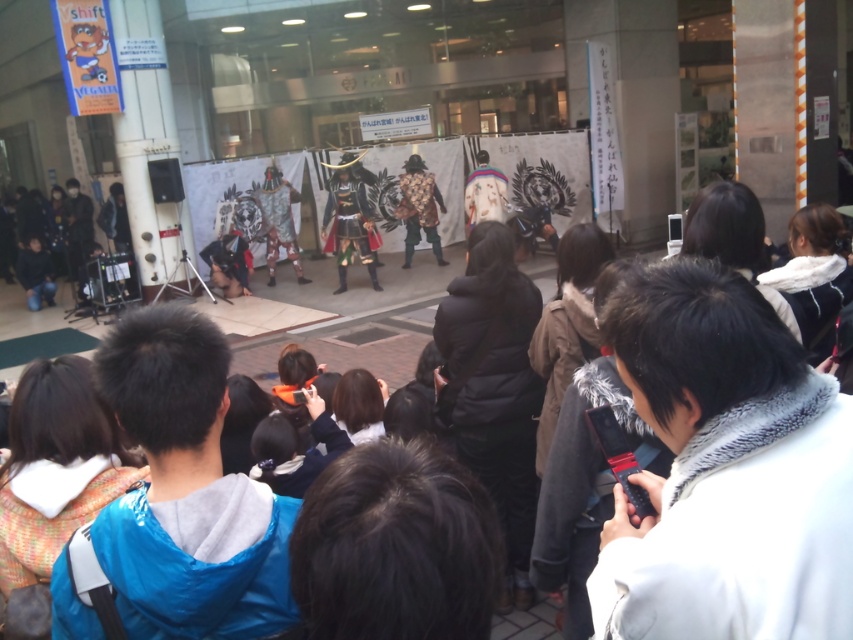
Question: Which of these objects is positioned closest to the white fur-trimmed coat at center?

Choices:
 (A) shiny metallic armor at center
 (B) leather armor at center

Answer: (A)

Question: Which point is farther from the camera taking this photo?

Choices:
 (A) (442, 202)
 (B) (343, 237)
 (C) (796, 618)

Answer: (A)

Question: Does white fur-trimmed coat at center appear under shiny metallic armor at center?

Choices:
 (A) yes
 (B) no

Answer: (A)

Question: Which of the following is the closest to the observer?

Choices:
 (A) [x=347, y=225]
 (B) [x=596, y=577]

Answer: (B)

Question: Is white fur-trimmed coat at center above shiny metallic armor at center?

Choices:
 (A) no
 (B) yes

Answer: (A)

Question: Can you confirm if white fur-trimmed coat at center is bigger than leather armor at center?

Choices:
 (A) no
 (B) yes

Answer: (A)